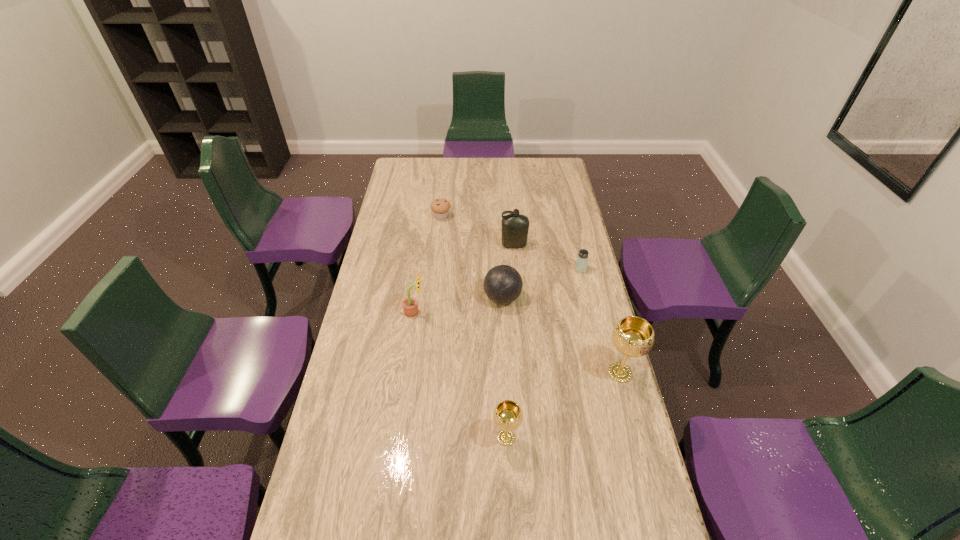
Find the location of a particular element. The image size is (960, 540). free spot between the bowling ball and the third farthest object is located at coordinates (541, 284).

This screenshot has width=960, height=540. What are the coordinates of `free point between the left chalice and the muffin` in the screenshot? It's located at (473, 327).

Locate an element on the screen. free space between the sunflower and the taller chalice is located at coordinates (517, 342).

Identify the location of free spot between the saltshaker and the shorter chalice. This screenshot has width=960, height=540. (543, 353).

Select which object appears as the sixth closest to the bottle. Please provide its 2D coordinates. Your answer should be formatted as a tuple, i.e. [(x, y)], where the tuple contains the x and y coordinates of a point satisfying the conditions above.

[(507, 415)]

This screenshot has height=540, width=960. I want to click on object that stands as the sixth closest to the right chalice, so click(x=440, y=207).

Locate an element on the screen. vacant space that satisfies the following two spatial constraints: 1. on the grip area of the farther chalice; 2. on the right side of the bowling ball is located at coordinates (506, 373).

I want to click on vacant position in the image that satisfies the following two spatial constraints: 1. on the face of the sunflower; 2. on the back side of the tallest object, so click(x=406, y=373).